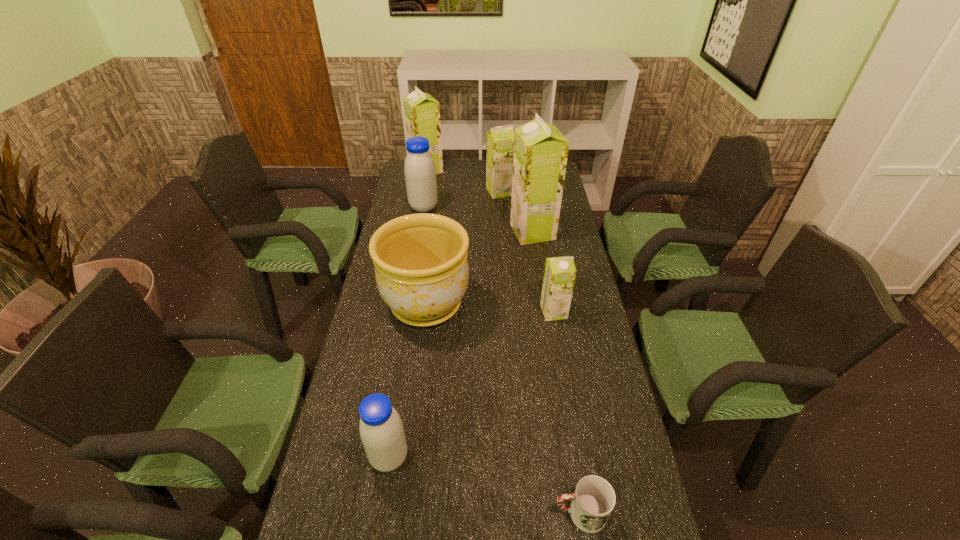
This screenshot has height=540, width=960. I want to click on the nearest green soya milk, so click(559, 275).

Where is `the seventh farthest object`? The image size is (960, 540). the seventh farthest object is located at coordinates (381, 429).

Where is `the nearer blue soya milk`? the nearer blue soya milk is located at coordinates (381, 429).

Where is `the shortest object`? This screenshot has height=540, width=960. the shortest object is located at coordinates (592, 503).

Where is `red cup`? The image size is (960, 540). red cup is located at coordinates (592, 503).

This screenshot has height=540, width=960. In order to click on vacant space located on the back of the tallest object in this screenshot , I will do `click(524, 172)`.

The image size is (960, 540). Identify the location of free space located on the right of the second tallest soya milk. (527, 170).

At what (x,y) coordinates should I click in order to perform the action: click on free region located 0.180m on the front of the second farthest object. Please return your answer as a coordinate pair (x, y). This screenshot has width=960, height=540. Looking at the image, I should click on (501, 222).

You are a GUI agent. You are given a task and a screenshot of the screen. Output one action in this format:
    pyautogui.click(x=<x>, y=<y>)
    Task: Click on the vacant space situated 0.290m on the right of the farther blue soya milk
    
    Given the screenshot: What is the action you would take?
    (507, 207)

Image resolution: width=960 pixels, height=540 pixels. Identify the location of vacant region located on the front of the flowerpot. (412, 419).